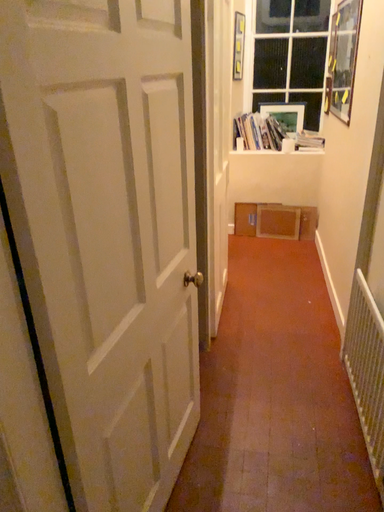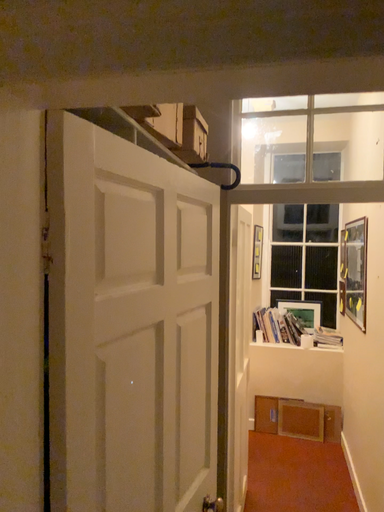
Question: How did the camera likely rotate when shooting the video?

Choices:
 (A) rotated downward
 (B) rotated upward

Answer: (B)